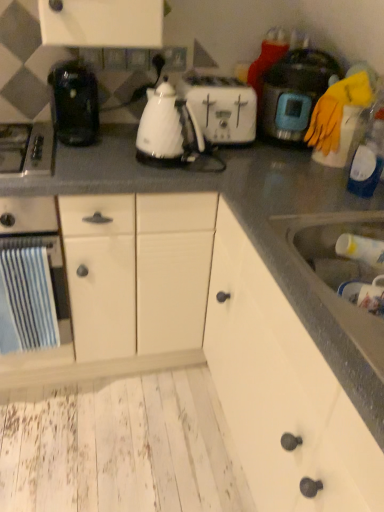
Question: Which direction should I rotate to look at white glossy electric kettle at center, which ranks as the second kitchen appliance in left-to-right order?

Choices:
 (A) right
 (B) left

Answer: (B)

Question: Considering the relative sizes of white matte cabinet at lower right, the first cabinetry positioned from the front, and matte black rice cooker at upper right, the 3th kitchen appliance viewed from the left, in the image provided, is white matte cabinet at lower right, the first cabinetry positioned from the front, smaller than matte black rice cooker at upper right, the 3th kitchen appliance viewed from the left,?

Choices:
 (A) no
 (B) yes

Answer: (A)

Question: Is white matte cabinet at lower right, arranged as the 2th cabinetry when viewed from the back, facing away from matte black rice cooker at upper right, the 3th kitchen appliance viewed from the left?

Choices:
 (A) no
 (B) yes

Answer: (A)

Question: Does white matte cabinet at lower right, the first cabinetry positioned from the front, lie behind matte black rice cooker at upper right, the 3th kitchen appliance viewed from the left?

Choices:
 (A) no
 (B) yes

Answer: (A)

Question: Is white matte cabinet at lower right, the first cabinetry positioned from the front, shorter than matte black rice cooker at upper right, the 3th kitchen appliance viewed from the left?

Choices:
 (A) no
 (B) yes

Answer: (B)

Question: From a real-world perspective, is white matte cabinet at lower right, arranged as the 2th cabinetry when viewed from the back, positioned over matte black rice cooker at upper right, the 3th kitchen appliance viewed from the left, based on gravity?

Choices:
 (A) no
 (B) yes

Answer: (A)

Question: Is white matte cabinet at lower right, arranged as the 2th cabinetry when viewed from the back, positioned in front of matte black rice cooker at upper right, the 3th kitchen appliance viewed from the left?

Choices:
 (A) yes
 (B) no

Answer: (A)

Question: Can you confirm if blue striped towel at left, marked as the third kitchen appliance in a right-to-left arrangement, is wider than white plastic toaster at center?

Choices:
 (A) yes
 (B) no

Answer: (A)

Question: Would you say blue striped towel at left, marked as the third kitchen appliance in a right-to-left arrangement, is outside white plastic toaster at center?

Choices:
 (A) no
 (B) yes

Answer: (B)

Question: Can you confirm if blue striped towel at left, the 1th kitchen appliance positioned from the left, is thinner than white plastic toaster at center?

Choices:
 (A) yes
 (B) no

Answer: (B)

Question: Is blue striped towel at left, marked as the third kitchen appliance in a right-to-left arrangement, closer to the viewer compared to white plastic toaster at center?

Choices:
 (A) no
 (B) yes

Answer: (B)

Question: From a real-world perspective, is blue striped towel at left, the 1th kitchen appliance positioned from the left, located higher than white plastic toaster at center?

Choices:
 (A) no
 (B) yes

Answer: (A)

Question: Is blue striped towel at left, the 1th kitchen appliance positioned from the left, positioned far away from white plastic toaster at center?

Choices:
 (A) no
 (B) yes

Answer: (A)

Question: Is white glossy electric kettle at center, which ranks as the second kitchen appliance in left-to-right order, shorter than blue striped towel at left, the 1th kitchen appliance positioned from the left?

Choices:
 (A) yes
 (B) no

Answer: (A)